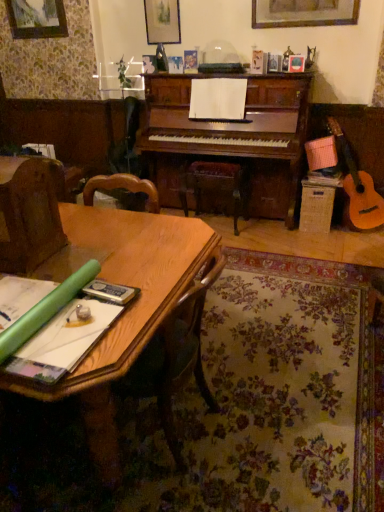
Question: Is brown fabric armchair at left to the right of wooden at center from the viewer's perspective?

Choices:
 (A) yes
 (B) no

Answer: (B)

Question: From the image's perspective, is brown fabric armchair at left over wooden at center?

Choices:
 (A) no
 (B) yes

Answer: (A)

Question: Does brown fabric armchair at left have a smaller size compared to wooden at center?

Choices:
 (A) no
 (B) yes

Answer: (B)

Question: Is brown fabric armchair at left placed right next to wooden at center?

Choices:
 (A) no
 (B) yes

Answer: (A)

Question: From a real-world perspective, is brown fabric armchair at left physically below wooden at center?

Choices:
 (A) yes
 (B) no

Answer: (B)

Question: Considering the relative sizes of brown fabric armchair at left and wooden at center in the image provided, is brown fabric armchair at left bigger than wooden at center?

Choices:
 (A) no
 (B) yes

Answer: (A)

Question: Could you tell me if wooden picture frame at upper left is turned towards green paper at lower left?

Choices:
 (A) yes
 (B) no

Answer: (B)

Question: Considering the relative sizes of wooden picture frame at upper left and green paper at lower left in the image provided, is wooden picture frame at upper left smaller than green paper at lower left?

Choices:
 (A) no
 (B) yes

Answer: (A)

Question: Can you confirm if wooden picture frame at upper left is bigger than green paper at lower left?

Choices:
 (A) yes
 (B) no

Answer: (A)

Question: Is wooden picture frame at upper left oriented away from green paper at lower left?

Choices:
 (A) no
 (B) yes

Answer: (A)

Question: Is wooden picture frame at upper left surrounding green paper at lower left?

Choices:
 (A) yes
 (B) no

Answer: (B)

Question: Is wooden picture frame at upper left completely or partially outside of green paper at lower left?

Choices:
 (A) yes
 (B) no

Answer: (A)

Question: Does brown fabric armchair at left lie in front of wooden picture frame at upper left?

Choices:
 (A) no
 (B) yes

Answer: (B)